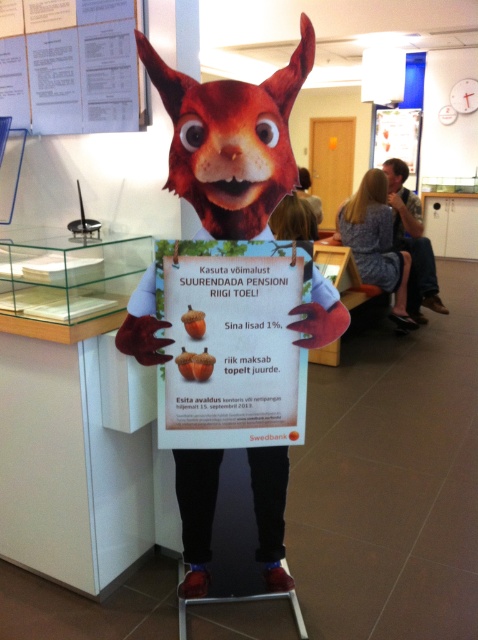
Is white paper at upper left to the left of smooth brown hair at center from the viewer's perspective?

Indeed, white paper at upper left is positioned on the left side of smooth brown hair at center.

Who is higher up, white paper at upper left or smooth brown hair at center?

smooth brown hair at center

Describe the element at coordinates (68, 65) in the screenshot. I see `white paper at upper left` at that location.

At what (x,y) coordinates should I click in order to perform the action: click on white paper at upper left. Please return your answer as a coordinate pair (x, y). The height and width of the screenshot is (640, 478). Looking at the image, I should click on (68, 65).

Who is more distant from viewer, (x=201, y=116) or (x=260, y=292)?

Positioned behind is point (x=260, y=292).

Measure the distance between matte brown costume at center and camera.

matte brown costume at center and camera are 4.62 feet apart from each other.

This screenshot has height=640, width=478. I want to click on matte brown costume at center, so click(x=230, y=140).

Who is higher up, matte brown costume at center or shiny plastic squirrel at upper center?

Positioned higher is shiny plastic squirrel at upper center.

Can you confirm if matte brown costume at center is positioned to the left of shiny plastic squirrel at upper center?

No, matte brown costume at center is not to the left of shiny plastic squirrel at upper center.

Which is behind, point (184, 182) or point (235, 145)?

The point (184, 182) is behind.

Locate an element on the screen. matte brown costume at center is located at coordinates (230, 140).